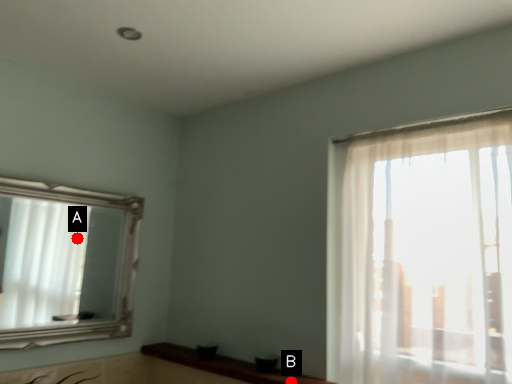
Question: Two points are circled on the image, labeled by A and B beside each circle. Which point is closer to the camera?

Choices:
 (A) A is closer
 (B) B is closer

Answer: (B)